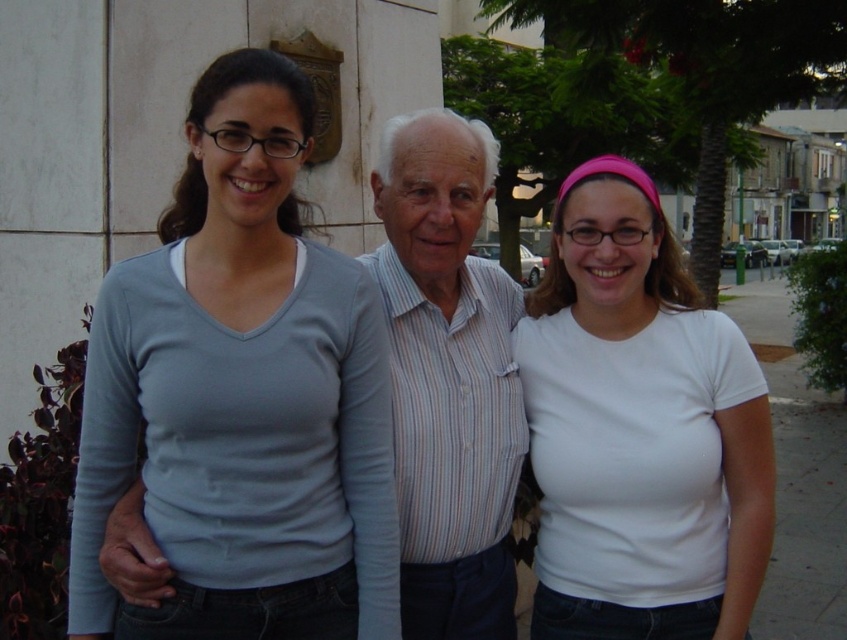
You are a photographer trying to capture a group photo of the three people in the image. You need to ensure that both the light blue fabric shirt at left and the light blue fabric shirt at center are clearly visible in the frame. Based on their sizes, which light blue fabric shirt should you focus on to ensure it stands out more in the photo?

The light blue fabric shirt at center should be focused on to ensure it stands out more in the photo because it occupies more space than the light blue fabric shirt at left.

You are taking a photo of the three people in the scene. The camera you are using has a rectangular frame that can only capture objects within the area from point A at the bottom left corner to point B at the top right corner. The frame spans from point A at coordinates 0.5 to 0.5 to point B at coordinates 0.7 to 0.4. Will the light blue fabric shirt at left be fully inside the camera frame?

The light blue fabric shirt at left is positioned at point [241,396], which falls within the camera frame spanning from point A at 0.5 to 0.5 to point B at 0.7 to 0.4. Therefore, the light blue fabric shirt at left will be fully inside the camera frame.